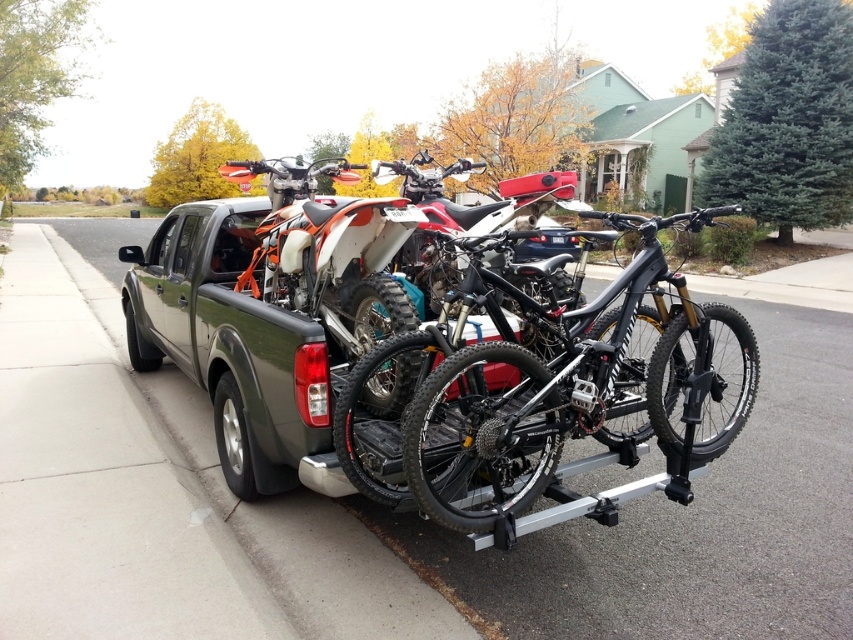
Is black matte bicycle at center closer to camera compared to matte black dirt bike at center?

Yes, it is.

This screenshot has width=853, height=640. What do you see at coordinates (575, 404) in the screenshot?
I see `black matte bicycle at center` at bounding box center [575, 404].

Who is more distant from viewer, (x=616, y=289) or (x=567, y=244)?

Positioned behind is point (x=567, y=244).

Where is `black matte bicycle at center`? black matte bicycle at center is located at coordinates (575, 404).